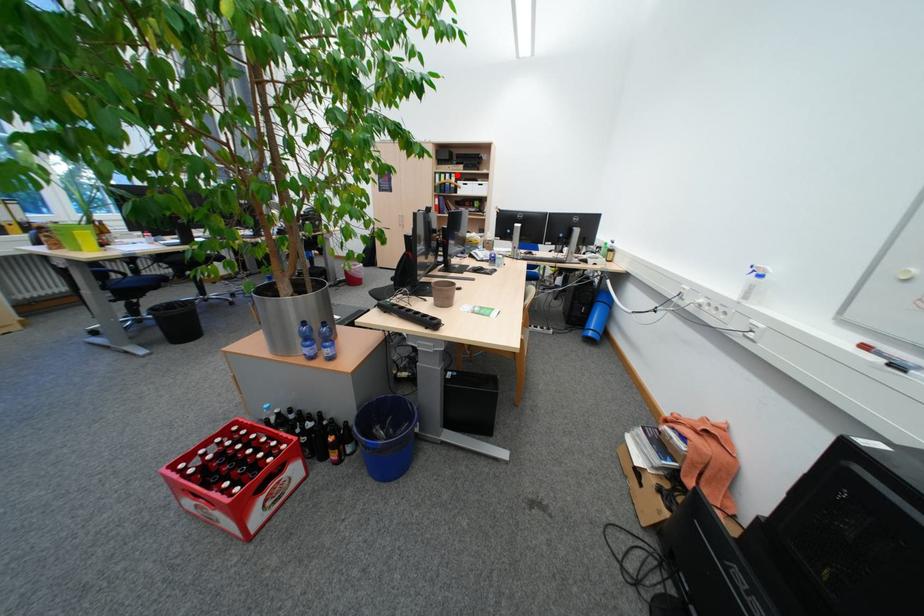
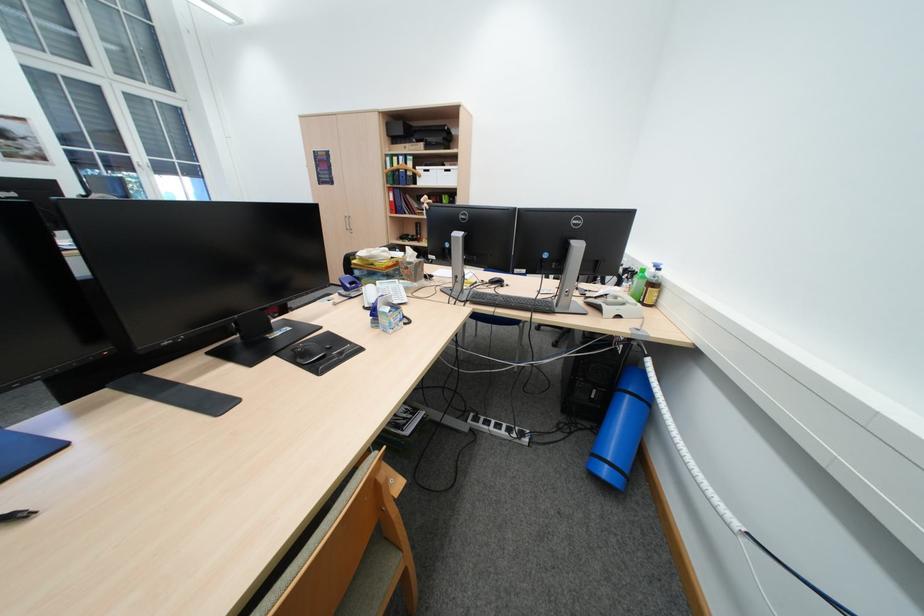
In the second image, find the point that corresponds to the highlighted location in the first image.

(409, 156)